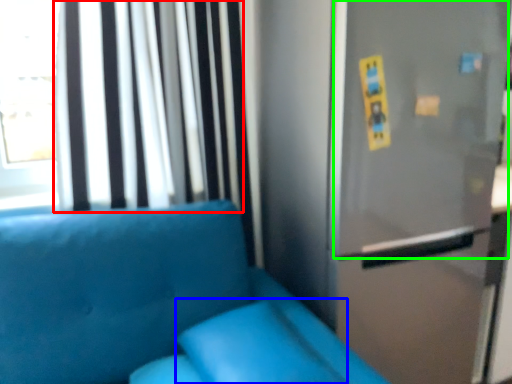
Question: Considering the real-world distances, which object is farthest from curtain (highlighted by a red box)? pillow (highlighted by a blue box) or screen door (highlighted by a green box)?

Choices:
 (A) pillow
 (B) screen door

Answer: (A)